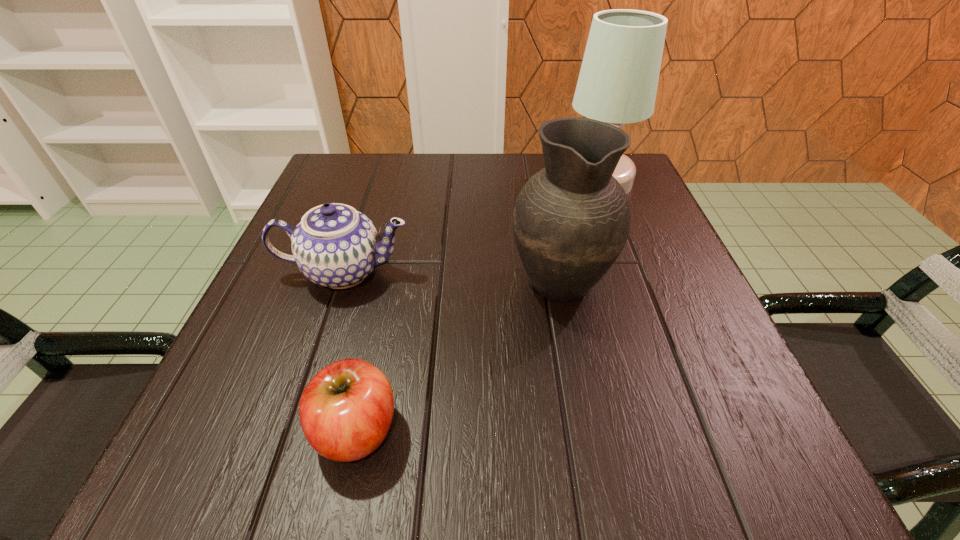
You are a GUI agent. You are given a task and a screenshot of the screen. Output one action in this format:
    pyautogui.click(x=<x>, y=<y>)
    Task: Click on the object at the near left corner
    The height and width of the screenshot is (540, 960).
    Given the screenshot: What is the action you would take?
    pyautogui.click(x=346, y=410)

Image resolution: width=960 pixels, height=540 pixels. In order to click on object present at the far right corner in this screenshot , I will do `click(618, 80)`.

Identify the location of blank area at the far edge. This screenshot has height=540, width=960. (506, 186).

In the image, there is a desktop. Where is `free space at the near edge`? free space at the near edge is located at coordinates (397, 425).

I want to click on free location at the left edge of the desktop, so [223, 370].

Where is `vacant area at the right edge`? The image size is (960, 540). vacant area at the right edge is located at coordinates (625, 290).

The width and height of the screenshot is (960, 540). In the image, there is a desktop. Find the location of `free region at the far left corner`. free region at the far left corner is located at coordinates (375, 200).

In the image, there is a desktop. Find the location of `vacant space at the near left corner`. vacant space at the near left corner is located at coordinates (242, 459).

You are a GUI agent. You are given a task and a screenshot of the screen. Output one action in this format:
    pyautogui.click(x=<x>, y=<y>)
    Task: Click on the free space between the apple and the farthest object
    The image size is (960, 540).
    Given the screenshot: What is the action you would take?
    (x=477, y=306)

Where is `free area in between the second tallest object and the chinaware`? free area in between the second tallest object and the chinaware is located at coordinates (452, 275).